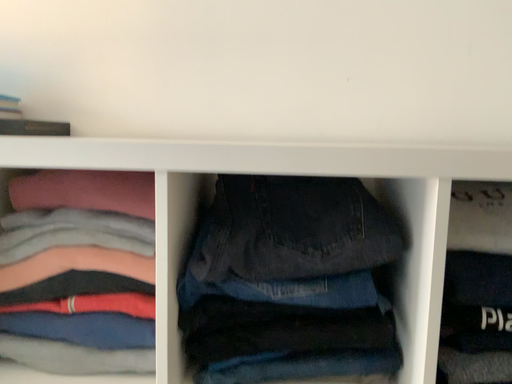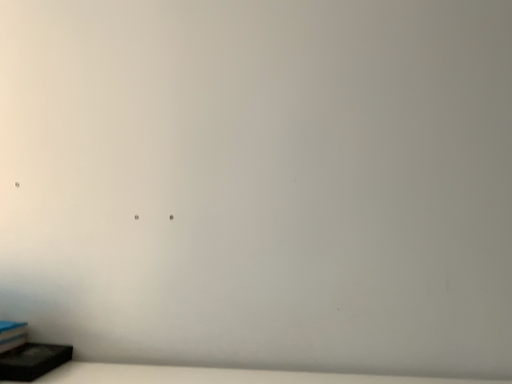
Question: How did the camera likely rotate when shooting the video?

Choices:
 (A) rotated downward
 (B) rotated upward

Answer: (B)